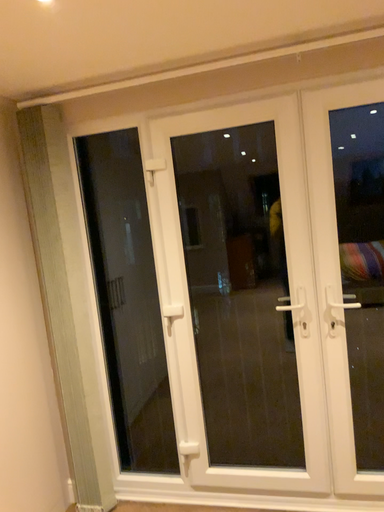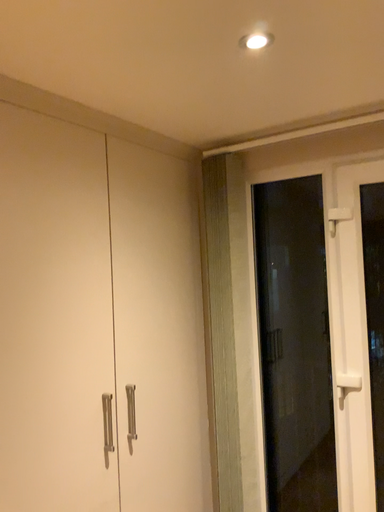
Question: How did the camera likely rotate when shooting the video?

Choices:
 (A) rotated upward
 (B) rotated downward

Answer: (A)